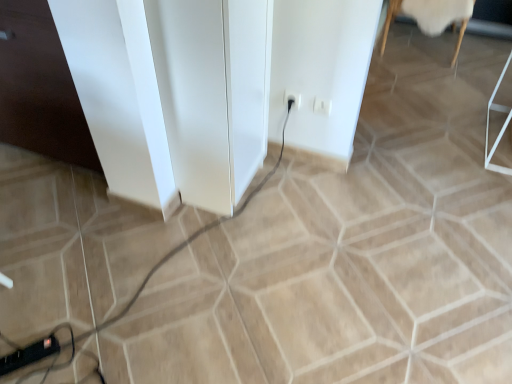
Question: From the image's perspective, is white plastic socket at center above or below black plastic extension cord at lower left?

Choices:
 (A) above
 (B) below

Answer: (A)

Question: From a real-world perspective, relative to black plastic extension cord at lower left, is white plastic socket at center vertically above or below?

Choices:
 (A) below
 (B) above

Answer: (B)

Question: Based on their relative distances, which object is nearer to the white glossy file cabinet at left, placed as the second file cabinet when sorted from right to left?

Choices:
 (A) black rubber cable at lower left
 (B) black plastic extension cord at lower left
 (C) white glossy file cabinet at center, acting as the 1th file cabinet starting from the right
 (D) white plastic electric outlet at center-right
 (E) white woolen rug at upper right

Answer: (C)

Question: Which object is positioned farthest from the white glossy file cabinet at center, the second file cabinet from the left?

Choices:
 (A) white plastic electric outlet at center-right
 (B) black rubber cable at lower left
 (C) black plastic extension cord at lower left
 (D) white plastic socket at center
 (E) white woolen rug at upper right

Answer: (E)